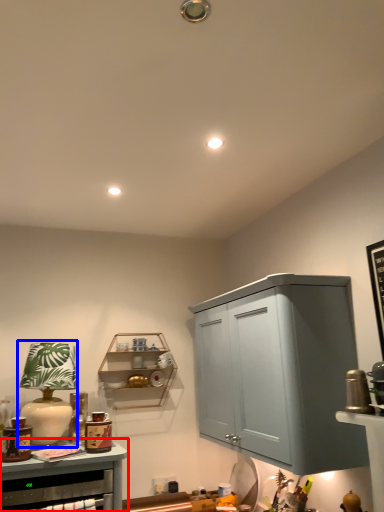
Question: Which object is closer to the camera taking this photo, cabinetry (highlighted by a red box) or table lamp (highlighted by a blue box)?

Choices:
 (A) cabinetry
 (B) table lamp

Answer: (A)